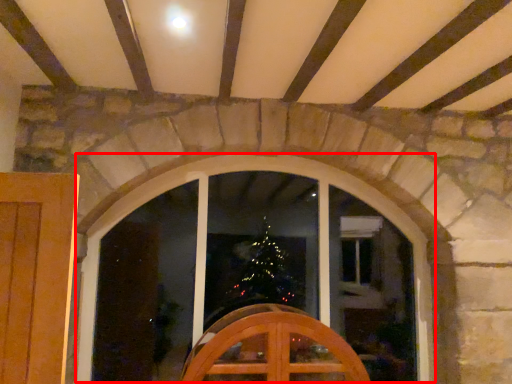
Question: From the image's perspective, where is window (annotated by the red box) located relative to furniture?

Choices:
 (A) below
 (B) above

Answer: (B)